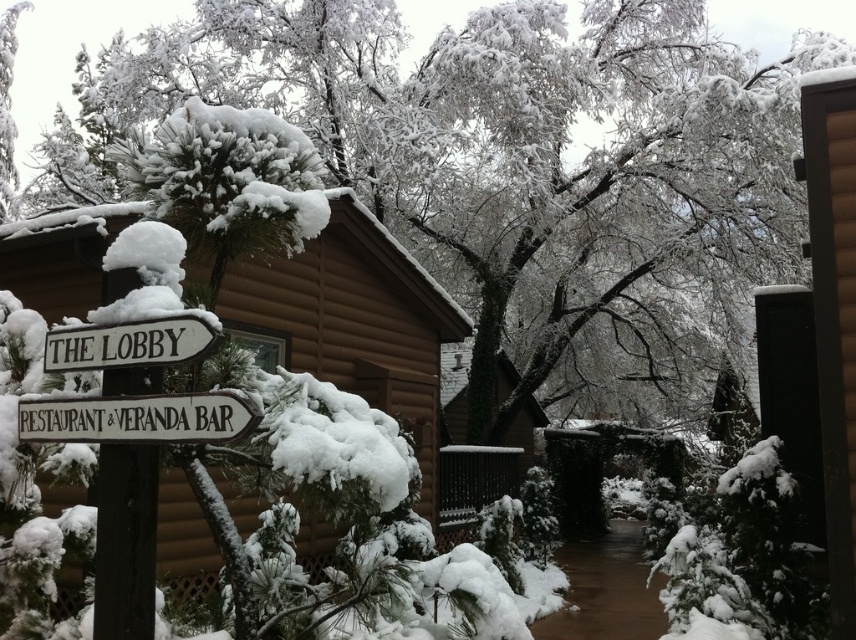
You are standing at the white wooden sign at center and want to go to THE LOBBY. Which direction should you face and why?

You should face the direction pointed by the left arrow on the white wooden sign at center because it indicates the path to THE LOBBY.